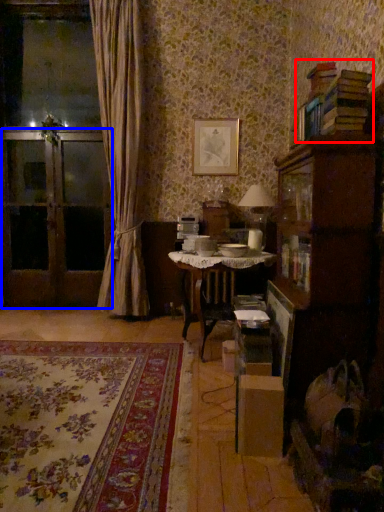
Question: Which object appears farthest to the camera in this image, book (highlighted by a red box) or screen door (highlighted by a blue box)?

Choices:
 (A) book
 (B) screen door

Answer: (B)